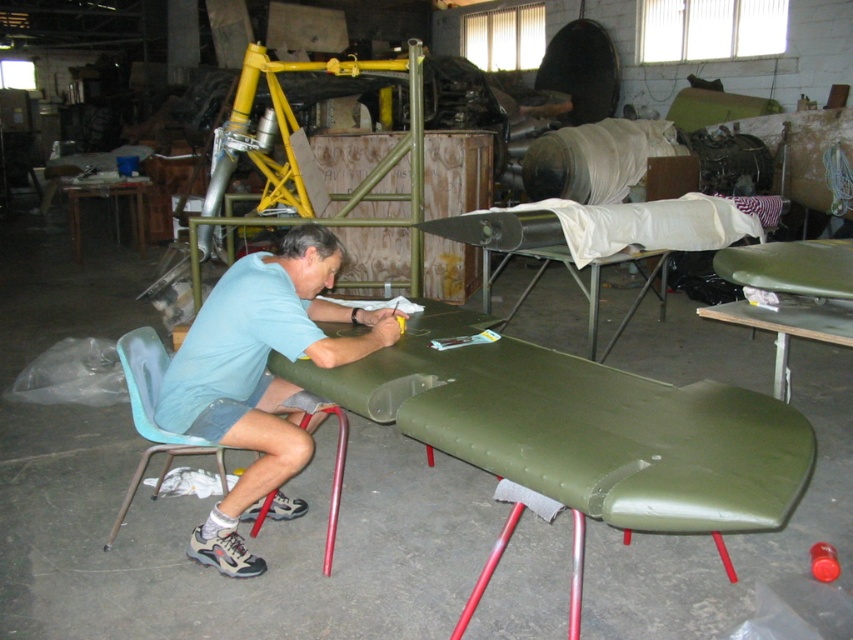
Is olive-green matte/leather-like airplane wing at center bigger than light blue t-shirt at center?

Yes, olive-green matte/leather-like airplane wing at center is bigger than light blue t-shirt at center.

Who is taller, olive-green matte/leather-like airplane wing at center or light blue t-shirt at center?

Standing taller between the two is light blue t-shirt at center.

Between point (466, 400) and point (204, 356), which one is positioned behind?

The point (204, 356) is behind.

Identify the location of olive-green matte/leather-like airplane wing at center. The height and width of the screenshot is (640, 853). (x=581, y=432).

Between light blue t-shirt at center and teal plastic chair at lower left, which one has less height?

teal plastic chair at lower left is shorter.

Is light blue t-shirt at center taller than teal plastic chair at lower left?

Yes.

Identify the location of light blue t-shirt at center. (260, 378).

Image resolution: width=853 pixels, height=640 pixels. What are the coordinates of `light blue t-shirt at center` in the screenshot? It's located at (260, 378).

Image resolution: width=853 pixels, height=640 pixels. Describe the element at coordinates (581, 432) in the screenshot. I see `olive-green matte/leather-like airplane wing at center` at that location.

Does olive-green matte/leather-like airplane wing at center have a larger size compared to teal plastic chair at lower left?

Correct, olive-green matte/leather-like airplane wing at center is larger in size than teal plastic chair at lower left.

Is point (659, 449) positioned in front of point (149, 456)?

Yes, it is in front of point (149, 456).

The height and width of the screenshot is (640, 853). What are the coordinates of `olive-green matte/leather-like airplane wing at center` in the screenshot? It's located at pos(581,432).